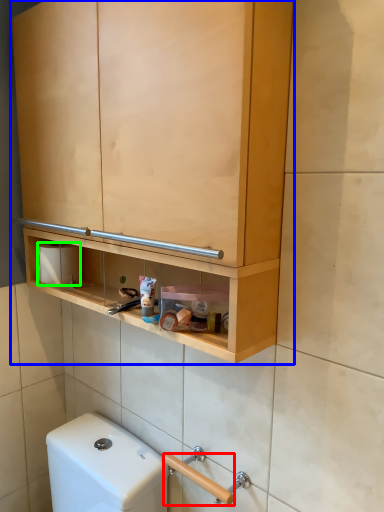
Question: Which object is positioned farthest from door handle (highlighted by a red box)? Select from cabinetry (highlighted by a blue box) and toilet paper (highlighted by a green box).

Choices:
 (A) cabinetry
 (B) toilet paper

Answer: (A)